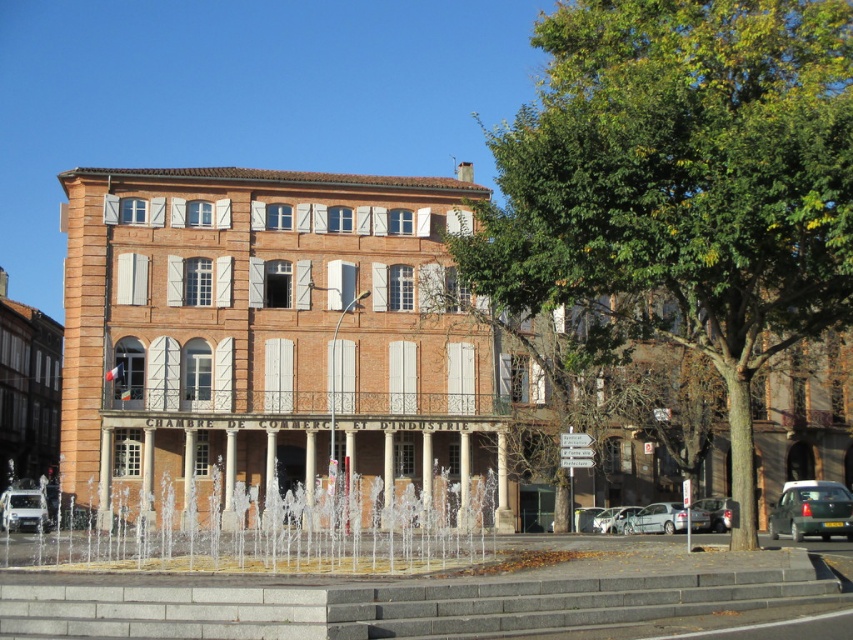
Question: Does brown brick building at center appear on the left side of gray concrete stairs at center?

Choices:
 (A) yes
 (B) no

Answer: (A)

Question: Which point is farther to the camera?

Choices:
 (A) brown brick building at center
 (B) silver metallic car at lower center

Answer: (B)

Question: Which object is the farthest from the brown brick building at center?

Choices:
 (A) clear water at center
 (B) gray concrete stairs at center
 (C) silver metallic car at lower center

Answer: (B)

Question: Can you confirm if gray concrete stairs at center is positioned above silver metallic car at lower center?

Choices:
 (A) no
 (B) yes

Answer: (B)

Question: Estimate the real-world distances between objects in this image. Which object is farther from the silver metallic car at lower center?

Choices:
 (A) silver metallic car at lower right
 (B) gray concrete stairs at center
 (C) white matte car at lower left
 (D) brown brick building at center

Answer: (B)

Question: Is green matte car at lower right further to camera compared to silver metallic car at lower center?

Choices:
 (A) yes
 (B) no

Answer: (B)